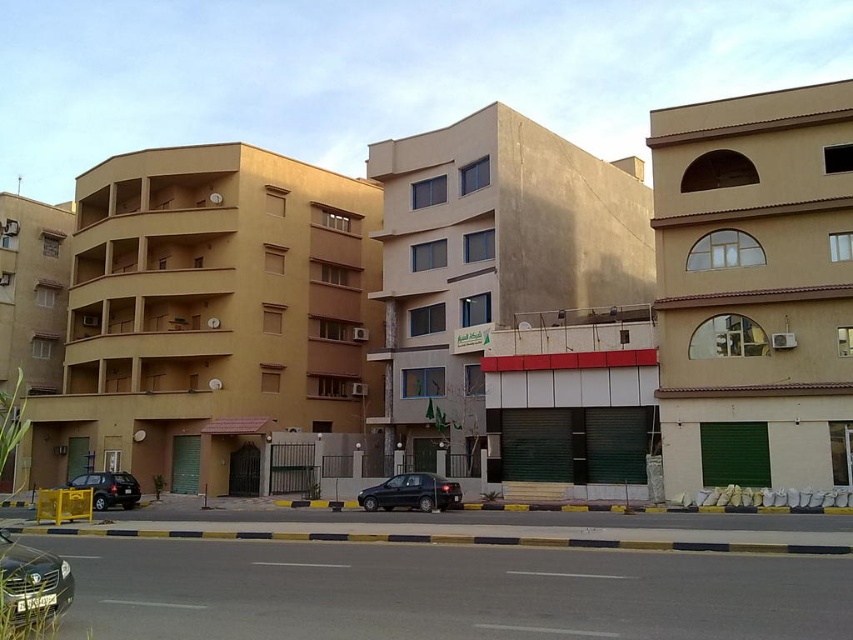
Does shiny black sedan at center appear on the left side of matte black suv at left?

No, shiny black sedan at center is not to the left of matte black suv at left.

Can you confirm if shiny black sedan at center is bigger than matte black suv at left?

No.

Who is more forward, (x=364, y=496) or (x=82, y=488)?

Positioned in front is point (x=364, y=496).

The image size is (853, 640). In order to click on shiny black sedan at center in this screenshot , I will do `click(410, 493)`.

Who is shorter, shiny black sedan at lower left or matte black suv at left?

With less height is shiny black sedan at lower left.

Between point (42, 557) and point (94, 496), which one is positioned in front?

Positioned in front is point (42, 557).

Is point (33, 548) more distant than point (96, 474)?

No.

Find the location of a particular element. The height and width of the screenshot is (640, 853). shiny black sedan at lower left is located at coordinates (32, 582).

Does shiny black sedan at lower left appear on the left side of shiny black sedan at center?

Yes, shiny black sedan at lower left is to the left of shiny black sedan at center.

Can you confirm if shiny black sedan at lower left is smaller than shiny black sedan at center?

Indeed, shiny black sedan at lower left has a smaller size compared to shiny black sedan at center.

This screenshot has height=640, width=853. What are the coordinates of `shiny black sedan at lower left` in the screenshot? It's located at (32, 582).